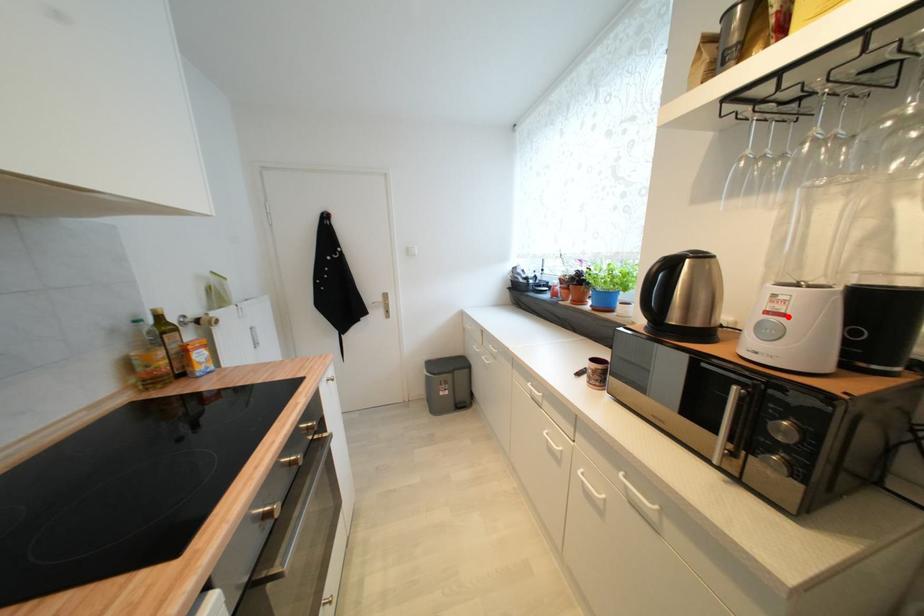
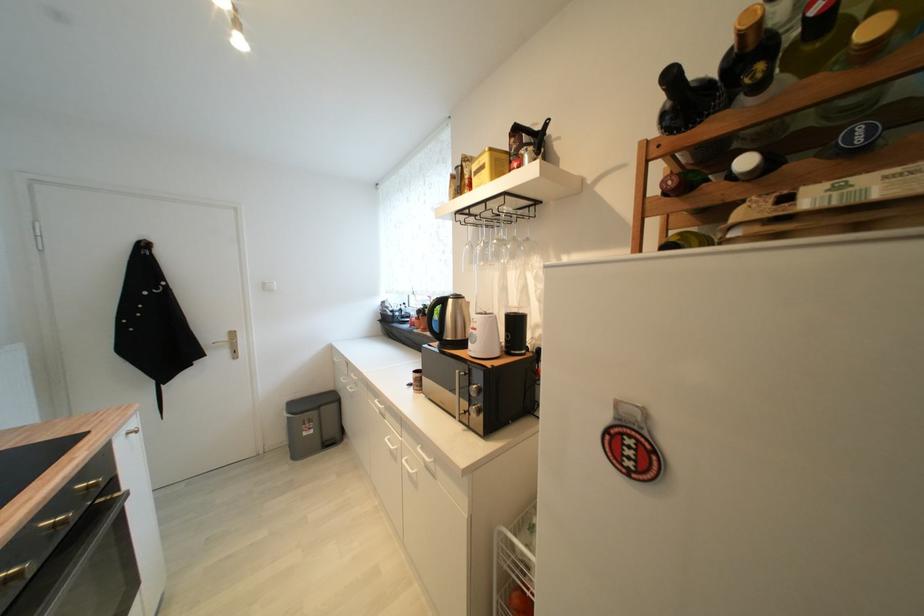
Find the pixel in the second image that matches the highlighted location in the first image.

(480, 331)